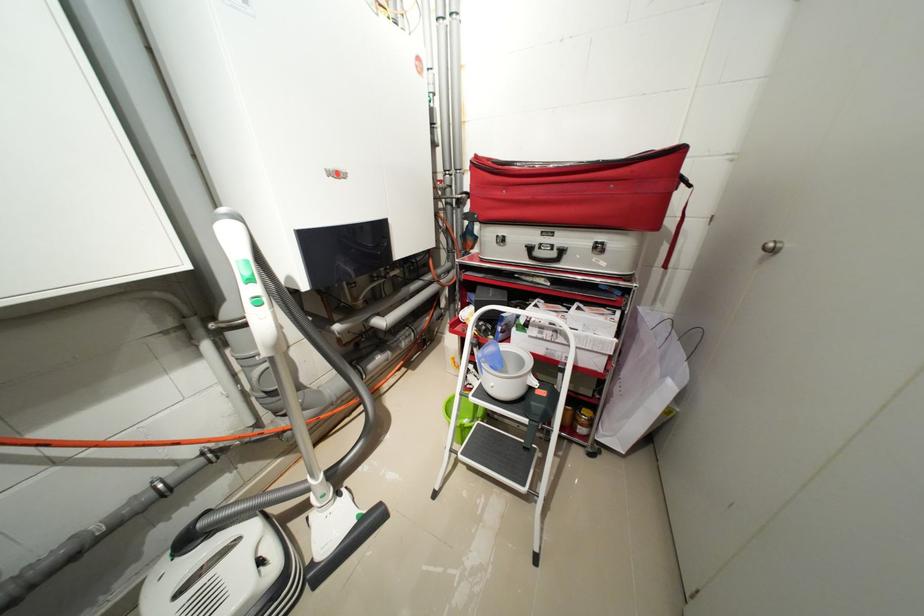
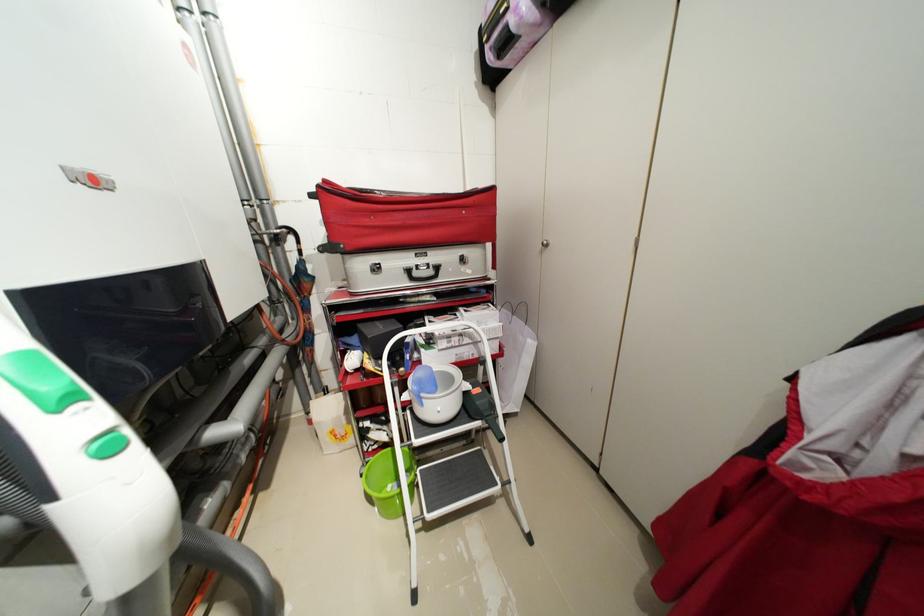
Find the pixel in the second image that matches (488,368) in the first image.

(428, 400)